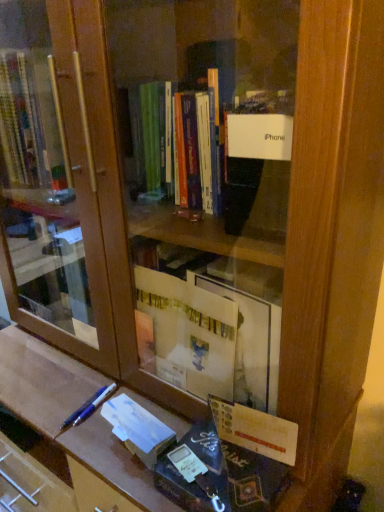
Question: In terms of height, does blue metallic pen at lower left look taller or shorter compared to white matte paperback book at lower center?

Choices:
 (A) short
 (B) tall

Answer: (A)

Question: Considering the positions of point (102, 389) and point (134, 429), is point (102, 389) closer or farther from the camera than point (134, 429)?

Choices:
 (A) farther
 (B) closer

Answer: (A)

Question: Is blue metallic pen at lower left situated inside white matte paperback book at lower center or outside?

Choices:
 (A) outside
 (B) inside

Answer: (A)

Question: Would you say white matte paperback book at lower center is inside or outside blue metallic pen at lower left?

Choices:
 (A) inside
 (B) outside

Answer: (B)

Question: Is white matte paperback book at lower center in front of or behind blue metallic pen at lower left in the image?

Choices:
 (A) behind
 (B) front

Answer: (B)

Question: Is point (148, 467) closer or farther from the camera than point (100, 394)?

Choices:
 (A) farther
 (B) closer

Answer: (B)

Question: From the image's perspective, is white matte paperback book at lower center above or below blue metallic pen at lower left?

Choices:
 (A) above
 (B) below

Answer: (B)